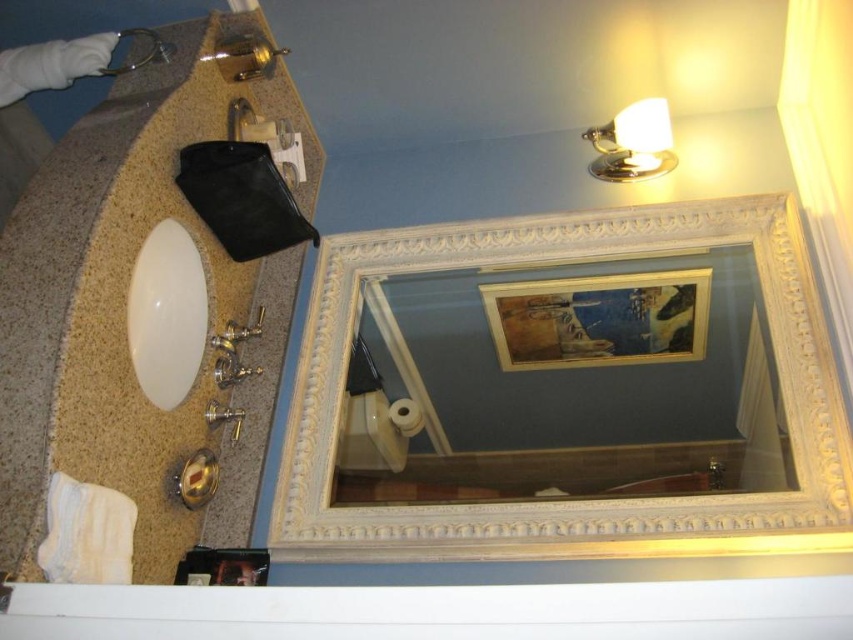
Between point (728, 214) and point (242, 104), which one is positioned in front?

Point (728, 214) is in front.

Can you confirm if white carved wood mirror at upper center is positioned to the right of brushed metal faucet at upper left?

Yes, white carved wood mirror at upper center is to the right of brushed metal faucet at upper left.

Does point (645, 208) come in front of point (241, 97)?

Yes, point (645, 208) is in front of point (241, 97).

I want to click on white carved wood mirror at upper center, so click(x=572, y=500).

Based on the photo, does white glossy sink at left lie in front of brushed metal faucet at upper left?

Yes, white glossy sink at left is closer to the viewer.

Is point (193, 342) positioned behind point (244, 108)?

No, (193, 342) is closer to viewer.

Measure the distance between point (164, 320) and camera.

Point (164, 320) is 1.48 meters from camera.

Locate an element on the screen. The width and height of the screenshot is (853, 640). white glossy sink at left is located at coordinates (166, 314).

In the scene shown: Does white glossy sink at left have a larger size compared to brushed metal faucet at lower center?

Yes.

Which of these two, white glossy sink at left or brushed metal faucet at lower center, stands shorter?

brushed metal faucet at lower center

You are a GUI agent. You are given a task and a screenshot of the screen. Output one action in this format:
    pyautogui.click(x=<x>, y=<y>)
    Task: Click on the white glossy sink at left
    
    Given the screenshot: What is the action you would take?
    pyautogui.click(x=166, y=314)